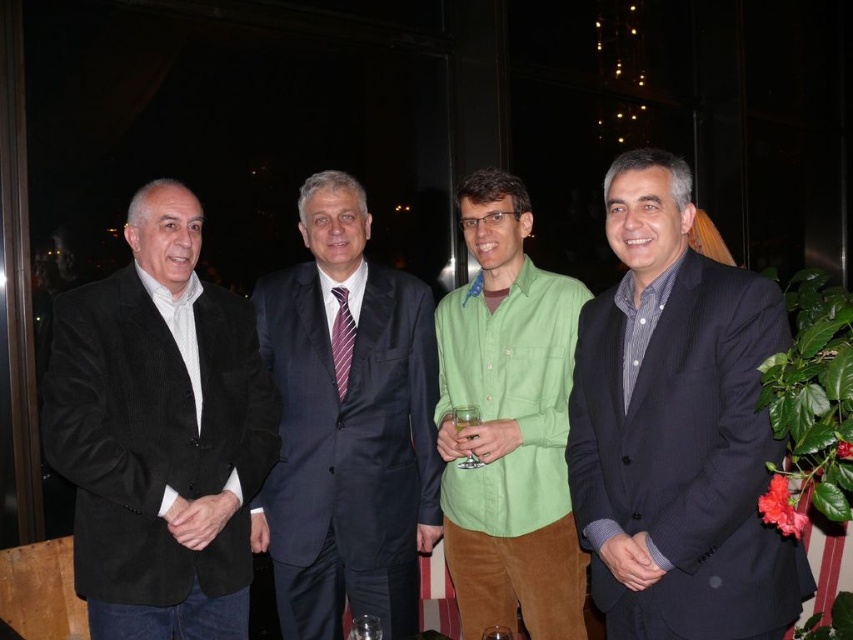
Looking at this image, based on the scene description, which object is taller between the dark blue suit at center and the green corduroy pants at center?

The dark blue suit at center is much taller than the green corduroy pants at center.

You are a photographer at this event and need to capture a clear photo of the clear glass at center without the black corduroy blazer at left blocking it. Which object should you move closer to, and why?

You should move closer to the clear glass at center because the black corduroy blazer at left is much taller than it, so moving closer to the glass will reduce the likelihood of the blazer blocking the view.

You are a photographer at a corporate event. You need to capture a photo of the person wearing the green corduroy pants at center and the clear glass at center. Based on their positions, which object is closer to the camera?

The green corduroy pants at center is located above the clear glass at center, so the green corduroy pants at center is closer to the camera.